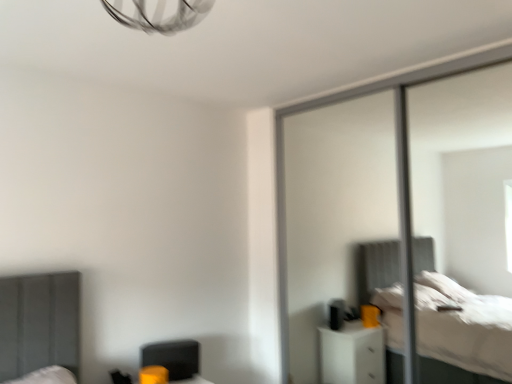
The image size is (512, 384). I want to click on vacant point above transparent glass screen door at right (from a real-world perspective), so click(378, 76).